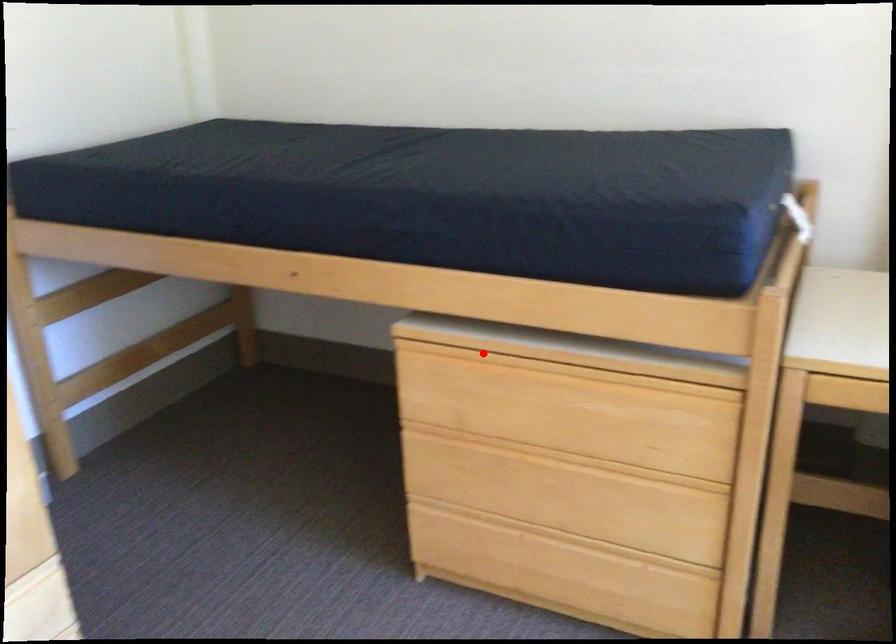
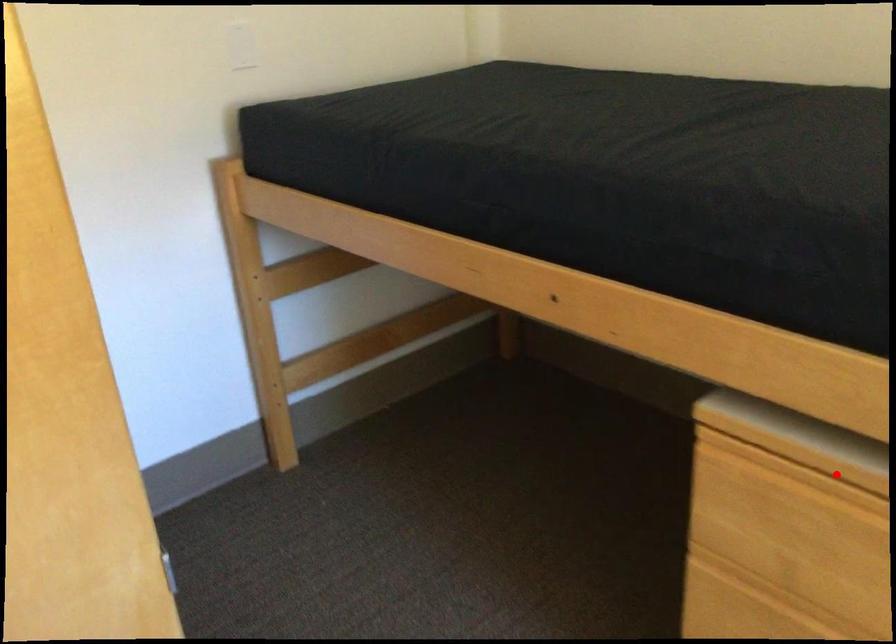
I am providing you with two images of the same scene from different viewpoints. A red point is marked on the first image and another point is marked on the second image. Does the point marked in image1 correspond to the same location as the one in image2?

Yes